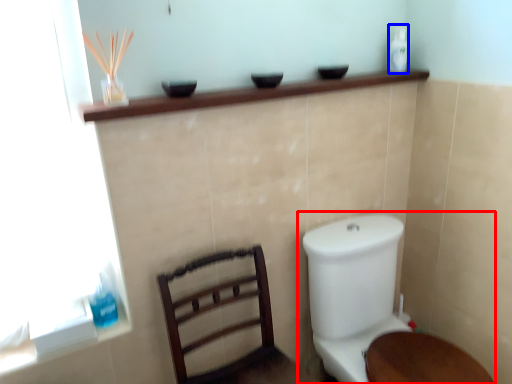
Question: Which object is closer to the camera taking this photo, toilet (highlighted by a red box) or toiletry (highlighted by a blue box)?

Choices:
 (A) toilet
 (B) toiletry

Answer: (A)